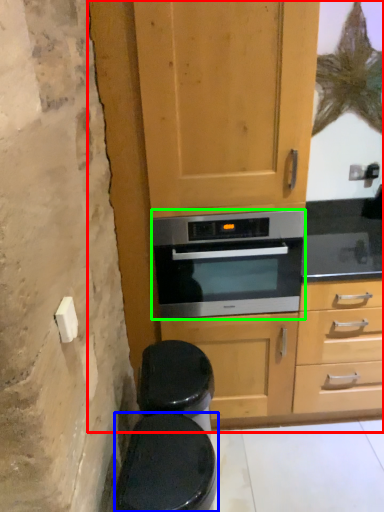
Question: Based on their relative distances, which object is nearer to dresser (highlighted by a red box)? Choose from toilet bowl (highlighted by a blue box) and oven (highlighted by a green box).

Choices:
 (A) toilet bowl
 (B) oven

Answer: (B)